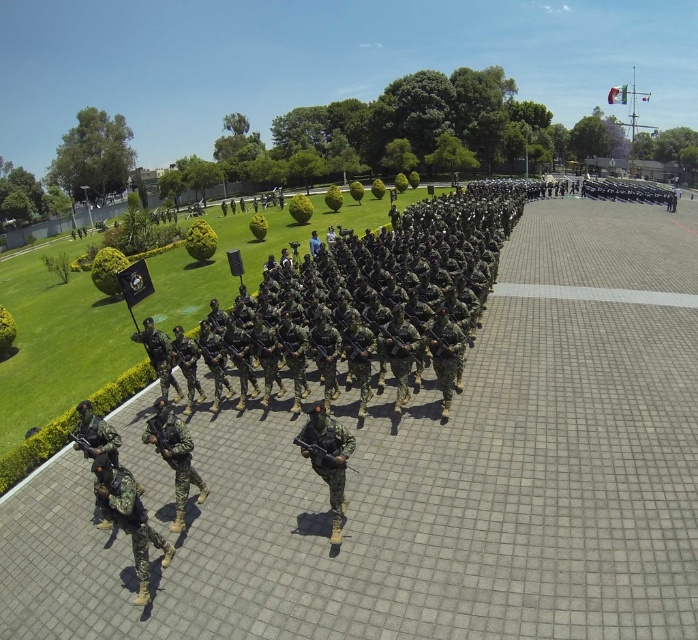
Question: Can you confirm if camouflage fabric uniform at lower left is positioned to the left of camouflage fabric uniform at center?

Choices:
 (A) no
 (B) yes

Answer: (A)

Question: Which object is positioned closest to the camouflage uniform at lower left?

Choices:
 (A) camouflage fabric soldier at center
 (B) camouflage fabric uniform at lower left
 (C) camouflage fabric uniform at center
 (D) camouflage uniform at center

Answer: (A)

Question: Which object is the closest to the camouflage uniform at center?

Choices:
 (A) camouflage uniform at lower left
 (B) camouflage fabric soldier at center
 (C) camouflage fabric uniform at center

Answer: (B)

Question: In this image, where is camouflage fabric soldier at center located relative to camouflage fabric uniform at center?

Choices:
 (A) below
 (B) above

Answer: (A)

Question: Is camouflage uniform at center closer to camera compared to camouflage uniform at lower left?

Choices:
 (A) yes
 (B) no

Answer: (A)

Question: Which object is the farthest from the camouflage uniform at center?

Choices:
 (A) camouflage fabric uniform at center
 (B) camouflage fabric soldier at center
 (C) camouflage uniform at lower left

Answer: (A)